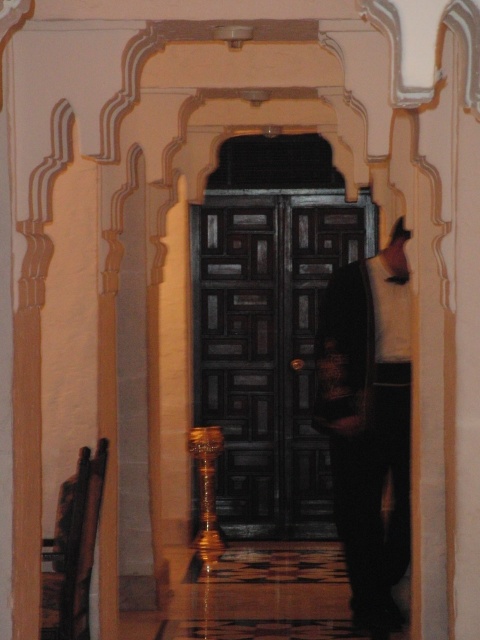
Between dark wood door at center and dark brown leather jacket at center, which one has more height?

dark wood door at center

Is dark wood door at center bigger than dark brown leather jacket at center?

Correct, dark wood door at center is larger in size than dark brown leather jacket at center.

The image size is (480, 640). What do you see at coordinates (267, 348) in the screenshot?
I see `dark wood door at center` at bounding box center [267, 348].

This screenshot has height=640, width=480. In order to click on dark wood door at center in this screenshot , I will do `click(267, 348)`.